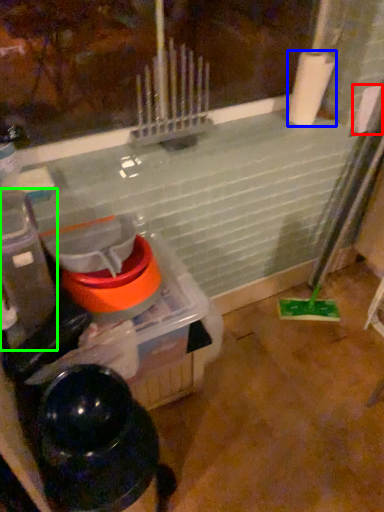
Question: Estimate the real-world distances between objects in this image. Which object is farther from toilet paper (highlighted by a red box), paper towel (highlighted by a blue box) or appliance (highlighted by a green box)?

Choices:
 (A) paper towel
 (B) appliance

Answer: (B)